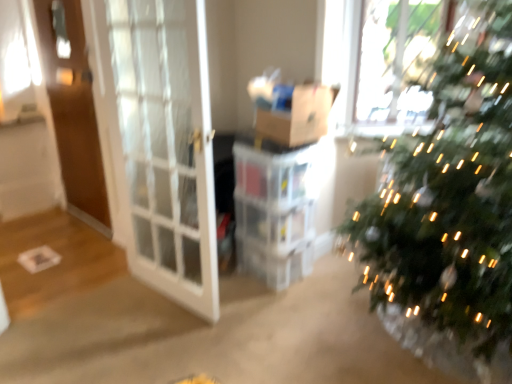
Locate an element on the screen. The width and height of the screenshot is (512, 384). brown wooden screen door at left, acting as the 2th screen door starting from the front is located at coordinates (73, 110).

From the image's perspective, which is below, white glass screen door at left, which is the second screen door from left to right, or brown cardboard box at center?

white glass screen door at left, which is the second screen door from left to right, appears lower in the image.

Considering the points (147, 278) and (295, 88), which point is behind, point (147, 278) or point (295, 88)?

Positioned behind is point (147, 278).

Looking at this image, is white glass screen door at left, which is the second screen door from left to right, placed right next to brown cardboard box at center?

They are not placed beside each other.

How many degrees apart are the facing directions of white glass screen door at left, which is the second screen door from left to right, and brown cardboard box at center?

94.1 degrees separate the facing orientations of white glass screen door at left, which is the second screen door from left to right, and brown cardboard box at center.

From a real-world perspective, count 1st screen doors downward from the brown cardboard box at center and point to it. Please provide its 2D coordinates.

[(73, 110)]

Is brown cardboard box at center facing away from brown wooden screen door at left, acting as the 2th screen door starting from the front?

No.

From the image's perspective, is brown cardboard box at center located above brown wooden screen door at left, placed as the 1th screen door when sorted from left to right?

Actually, brown cardboard box at center appears below brown wooden screen door at left, placed as the 1th screen door when sorted from left to right, in the image.

From a real-world perspective, is brown cardboard box at center on top of brown wooden screen door at left, the 2th screen door in the right-to-left sequence?

Correct, in the physical world, brown cardboard box at center is higher than brown wooden screen door at left, the 2th screen door in the right-to-left sequence.

Is white glass screen door at left, which is the second screen door from left to right, not near brown wooden screen door at left, acting as the 1th screen door starting from the back?

white glass screen door at left, which is the second screen door from left to right, is near brown wooden screen door at left, acting as the 1th screen door starting from the back, not far away.

Considering the points (136, 45) and (90, 162), which point is in front, point (136, 45) or point (90, 162)?

The point (136, 45) is in front.

Considering the relative positions of white glass screen door at left, which appears as the first screen door when viewed from the front, and brown wooden screen door at left, the 2th screen door in the right-to-left sequence, in the image provided, is white glass screen door at left, which appears as the first screen door when viewed from the front, to the left of brown wooden screen door at left, the 2th screen door in the right-to-left sequence, from the viewer's perspective?

No, white glass screen door at left, which appears as the first screen door when viewed from the front, is not to the left of brown wooden screen door at left, the 2th screen door in the right-to-left sequence.

Considering the positions of objects brown wooden screen door at left, placed as the 1th screen door when sorted from left to right, and white glass screen door at left, arranged as the first screen door when viewed from the right, in the image provided, who is more to the left, brown wooden screen door at left, placed as the 1th screen door when sorted from left to right, or white glass screen door at left, arranged as the first screen door when viewed from the right,?

brown wooden screen door at left, placed as the 1th screen door when sorted from left to right.

From a real-world perspective, is brown wooden screen door at left, the 2th screen door in the right-to-left sequence, physically located above or below white glass screen door at left, which is the second screen door from left to right?

brown wooden screen door at left, the 2th screen door in the right-to-left sequence, is above white glass screen door at left, which is the second screen door from left to right.

Could you measure the distance between brown wooden screen door at left, the 2th screen door in the right-to-left sequence, and white glass screen door at left, arranged as the first screen door when viewed from the right?

The distance of brown wooden screen door at left, the 2th screen door in the right-to-left sequence, from white glass screen door at left, arranged as the first screen door when viewed from the right, is 34.72 inches.

From the image's perspective, which one is positioned higher, brown wooden screen door at left, acting as the 1th screen door starting from the back, or white glass screen door at left, which is the second screen door from left to right?

brown wooden screen door at left, acting as the 1th screen door starting from the back.

Is brown cardboard box at center completely or partially outside of white glass screen door at left, arranged as the second screen door when viewed from the back?

brown cardboard box at center is positioned outside white glass screen door at left, arranged as the second screen door when viewed from the back.

Is brown cardboard box at center oriented towards white glass screen door at left, arranged as the second screen door when viewed from the back?

No.

Could you measure the distance between brown cardboard box at center and white glass screen door at left, arranged as the second screen door when viewed from the back?

They are 27.55 inches apart.

What's the angular difference between brown cardboard box at center and white glass screen door at left, which appears as the first screen door when viewed from the front,'s facing directions?

The angular difference between brown cardboard box at center and white glass screen door at left, which appears as the first screen door when viewed from the front, is 94.1 degrees.

From a real-world perspective, which object rests below the other?

brown wooden screen door at left, acting as the 2th screen door starting from the front, from a real-world perspective.

Is brown cardboard box at center completely or partially inside brown wooden screen door at left, acting as the 2th screen door starting from the front?

Definitely not — brown cardboard box at center is not inside brown wooden screen door at left, acting as the 2th screen door starting from the front.

How many degrees apart are the facing directions of brown wooden screen door at left, acting as the 2th screen door starting from the front, and brown cardboard box at center?

The angle between the facing direction of brown wooden screen door at left, acting as the 2th screen door starting from the front, and the facing direction of brown cardboard box at center is 82.4 degrees.

Is brown wooden screen door at left, acting as the 2th screen door starting from the front, far from brown cardboard box at center?

brown wooden screen door at left, acting as the 2th screen door starting from the front, is far away from brown cardboard box at center.

Where is `screen door in front of the brown cardboard box at center`? The width and height of the screenshot is (512, 384). screen door in front of the brown cardboard box at center is located at coordinates (164, 142).

This screenshot has width=512, height=384. In order to click on cardboard box below the brown wooden screen door at left, acting as the 2th screen door starting from the front (from the image's perspective) in this screenshot , I will do `click(298, 116)`.

Which object lies further to the anchor point brown cardboard box at center, brown wooden screen door at left, placed as the 1th screen door when sorted from left to right, or white glass screen door at left, which is the second screen door from left to right?

Among the two, brown wooden screen door at left, placed as the 1th screen door when sorted from left to right, is located further to brown cardboard box at center.

In the scene shown: When comparing their distances from brown wooden screen door at left, the 2th screen door in the right-to-left sequence, does brown cardboard box at center or white glass screen door at left, arranged as the second screen door when viewed from the back, seem closer?

Among the two, white glass screen door at left, arranged as the second screen door when viewed from the back, is located nearer to brown wooden screen door at left, the 2th screen door in the right-to-left sequence.

Based on the photo, considering their positions, is brown cardboard box at center positioned further to white glass screen door at left, arranged as the first screen door when viewed from the right, than brown wooden screen door at left, acting as the 2th screen door starting from the front?

Based on the image, brown wooden screen door at left, acting as the 2th screen door starting from the front, appears to be further to white glass screen door at left, arranged as the first screen door when viewed from the right.

Considering their positions, is brown wooden screen door at left, the 2th screen door in the right-to-left sequence, positioned further to white glass screen door at left, arranged as the first screen door when viewed from the right, than brown cardboard box at center?

brown wooden screen door at left, the 2th screen door in the right-to-left sequence, is further to white glass screen door at left, arranged as the first screen door when viewed from the right.

Looking at the image, which one is located closer to brown wooden screen door at left, the 2th screen door in the right-to-left sequence, white glass screen door at left, which is the second screen door from left to right, or brown cardboard box at center?

white glass screen door at left, which is the second screen door from left to right, lies closer to brown wooden screen door at left, the 2th screen door in the right-to-left sequence, than the other object.

Consider the image. Estimate the real-world distances between objects in this image. Which object is closer to brown cardboard box at center, white glass screen door at left, arranged as the second screen door when viewed from the back, or brown wooden screen door at left, acting as the 1th screen door starting from the back?

Based on the image, white glass screen door at left, arranged as the second screen door when viewed from the back, appears to be nearer to brown cardboard box at center.

At what (x,y) coordinates should I click in order to perform the action: click on screen door situated between brown wooden screen door at left, acting as the 1th screen door starting from the back, and brown cardboard box at center from left to right. Please return your answer as a coordinate pair (x, y). Looking at the image, I should click on (164, 142).